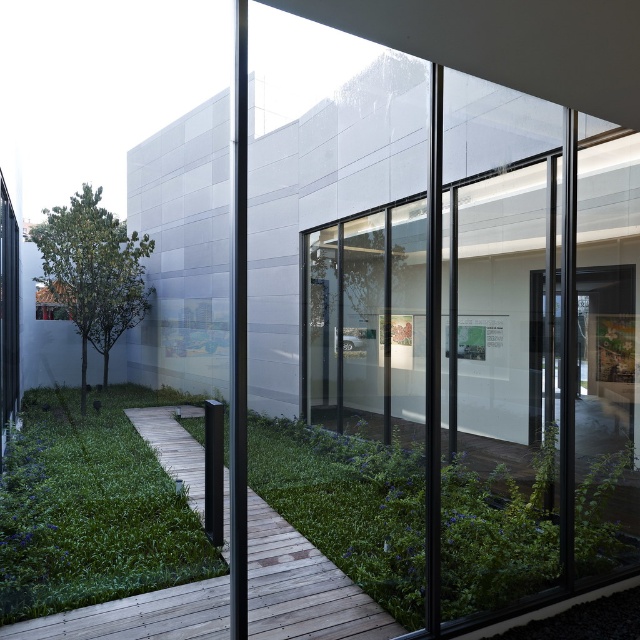
Question: Among these objects, which one is farthest from the camera?

Choices:
 (A) green grass at lower left
 (B) wooden planks at center

Answer: (B)

Question: Can you confirm if green grass at lower left is wider than wooden planks at center?

Choices:
 (A) yes
 (B) no

Answer: (A)

Question: Can you confirm if green grass at lower left is smaller than wooden planks at center?

Choices:
 (A) yes
 (B) no

Answer: (B)

Question: From the image, what is the correct spatial relationship of green grass at lower left in relation to wooden planks at center?

Choices:
 (A) right
 (B) left

Answer: (B)